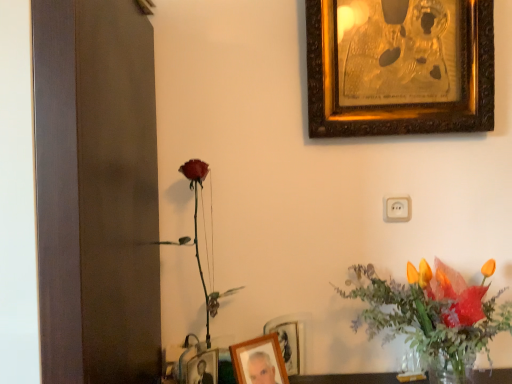
Question: Considering their positions, is gold ornate picture frame at upper right, the first picture frame when ordered from top to bottom, located in front of or behind wooden photo frame at lower center, the 2th picture frame positioned from the top?

Choices:
 (A) front
 (B) behind

Answer: (B)

Question: Is gold ornate picture frame at upper right, which appears as the 3th picture frame when ordered from the bottom, taller or shorter than wooden photo frame at lower center, the first picture frame positioned from the left?

Choices:
 (A) short
 (B) tall

Answer: (B)

Question: Which of these objects is positioned closest to the white plastic electric outlet at center?

Choices:
 (A) gold ornate picture frame at upper right, which appears as the 3th picture frame when ordered from the bottom
 (B) wooden photo frame at lower center, which appears as the second picture frame when viewed from the front
 (C) wooden photo frame at lower center, the first picture frame positioned from the left
 (D) translucent glass vase at lower right

Answer: (D)

Question: Based on their relative distances, which object is nearer to the wooden photo frame at lower center, the 2th picture frame positioned from the top?

Choices:
 (A) white plastic electric outlet at center
 (B) wooden photo frame at lower center, which appears as the second picture frame when viewed from the front
 (C) gold ornate picture frame at upper right, acting as the 3th picture frame starting from the left
 (D) translucent glass vase at lower right

Answer: (B)